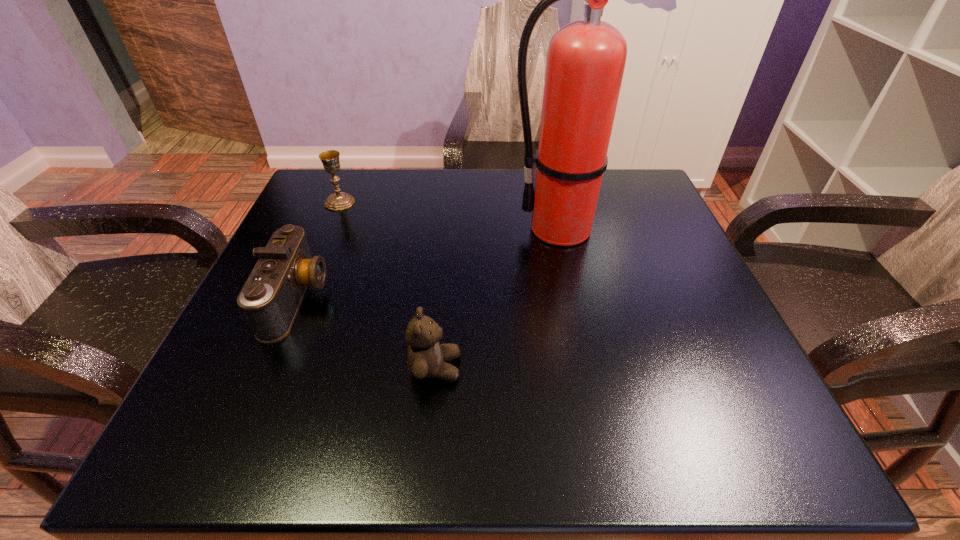
In the image, there is a desktop. Where is `free space at the right edge`? The image size is (960, 540). free space at the right edge is located at coordinates (658, 247).

The width and height of the screenshot is (960, 540). I want to click on free space at the far left corner of the desktop, so click(x=303, y=200).

In the image, there is a desktop. Identify the location of vacant space at the near left corner. (189, 426).

The height and width of the screenshot is (540, 960). In the image, there is a desktop. In order to click on vacant region at the far right corner in this screenshot , I will do `click(636, 224)`.

Locate an element on the screen. This screenshot has height=540, width=960. vacant space at the near right corner of the desktop is located at coordinates (678, 434).

The height and width of the screenshot is (540, 960). I want to click on empty location between the rightmost object and the chalice, so click(451, 215).

This screenshot has height=540, width=960. I want to click on vacant area that lies between the teddy bear and the tallest object, so click(499, 298).

Identify the location of free spot between the chalice and the fire extinguisher. This screenshot has width=960, height=540. (451, 215).

What are the coordinates of `free space that is in between the chalice and the third object from left to right` in the screenshot? It's located at (388, 285).

The width and height of the screenshot is (960, 540). Find the location of `free spot between the tallest object and the teddy bear`. free spot between the tallest object and the teddy bear is located at coordinates (499, 298).